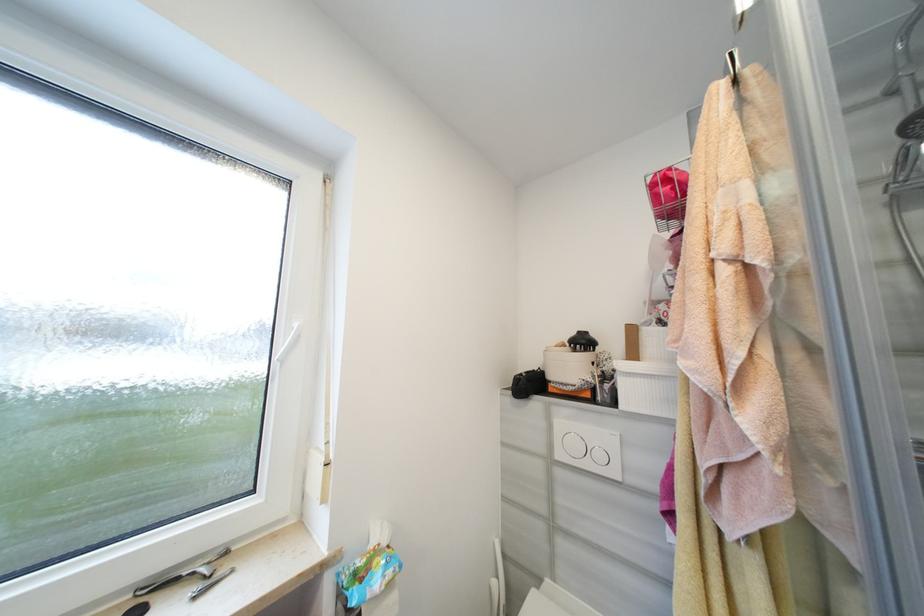
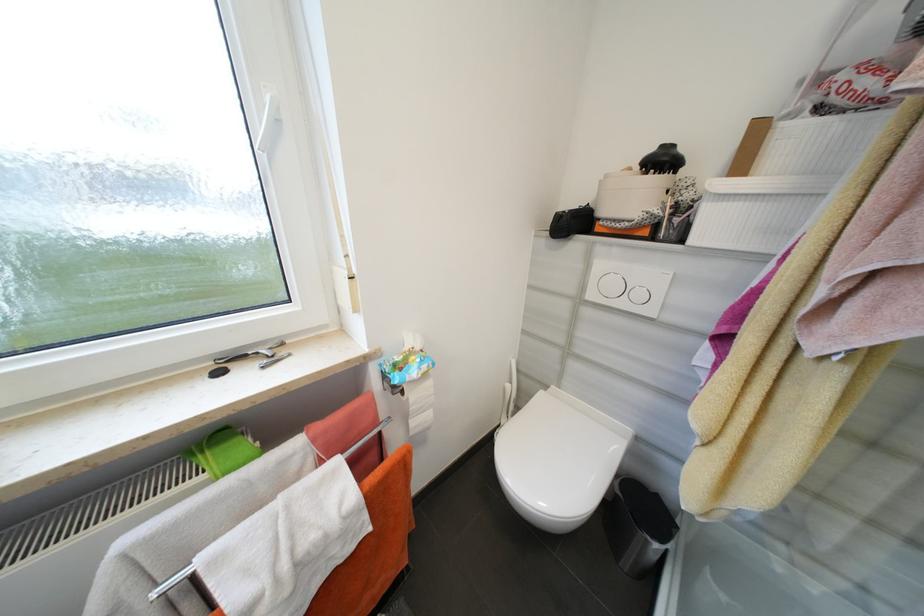
Locate, in the second image, the point that corresponds to pixel 604 456 in the first image.

(646, 296)